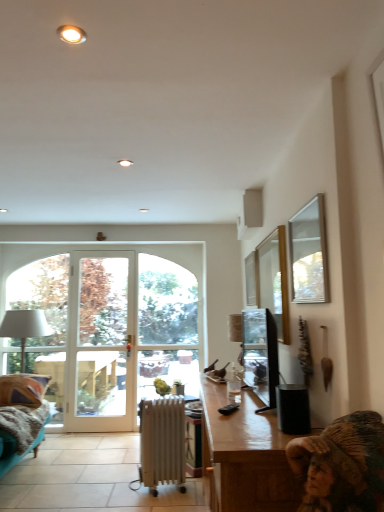
Question: Is wooden desk at lower right facing towards satin black television at right?

Choices:
 (A) no
 (B) yes

Answer: (A)

Question: Is wooden desk at lower right positioned behind satin black television at right?

Choices:
 (A) no
 (B) yes

Answer: (A)

Question: Does wooden desk at lower right have a greater width compared to satin black television at right?

Choices:
 (A) no
 (B) yes

Answer: (B)

Question: From the image's perspective, is wooden desk at lower right beneath satin black television at right?

Choices:
 (A) no
 (B) yes

Answer: (B)

Question: From a real-world perspective, is wooden desk at lower right below satin black television at right?

Choices:
 (A) no
 (B) yes

Answer: (B)

Question: Considering their positions, is plush fabric couch at lower left located in front of or behind white glass door at center?

Choices:
 (A) front
 (B) behind

Answer: (A)

Question: Considering the positions of point (46, 414) and point (92, 391), is point (46, 414) closer or farther from the camera than point (92, 391)?

Choices:
 (A) farther
 (B) closer

Answer: (B)

Question: From their relative heights in the image, would you say plush fabric couch at lower left is taller or shorter than white glass door at center?

Choices:
 (A) tall
 (B) short

Answer: (B)

Question: Looking at their shapes, would you say plush fabric couch at lower left is wider or thinner than white glass door at center?

Choices:
 (A) thin
 (B) wide

Answer: (B)

Question: Would you say white metallic radiator at center is to the left or to the right of white glass door at center in the picture?

Choices:
 (A) left
 (B) right

Answer: (B)

Question: From the image's perspective, is white metallic radiator at center above or below white glass door at center?

Choices:
 (A) below
 (B) above

Answer: (A)

Question: Is white metallic radiator at center spatially inside white glass door at center, or outside of it?

Choices:
 (A) outside
 (B) inside

Answer: (A)

Question: Considering the positions of white metallic radiator at center and white glass door at center in the image, is white metallic radiator at center taller or shorter than white glass door at center?

Choices:
 (A) tall
 (B) short

Answer: (B)

Question: Looking at their shapes, would you say white glass door at center is wider or thinner than white glass window at center, arranged as the 3th window when viewed from the front?

Choices:
 (A) thin
 (B) wide

Answer: (B)

Question: Considering the positions of point (74, 397) and point (188, 310), is point (74, 397) closer or farther from the camera than point (188, 310)?

Choices:
 (A) farther
 (B) closer

Answer: (B)